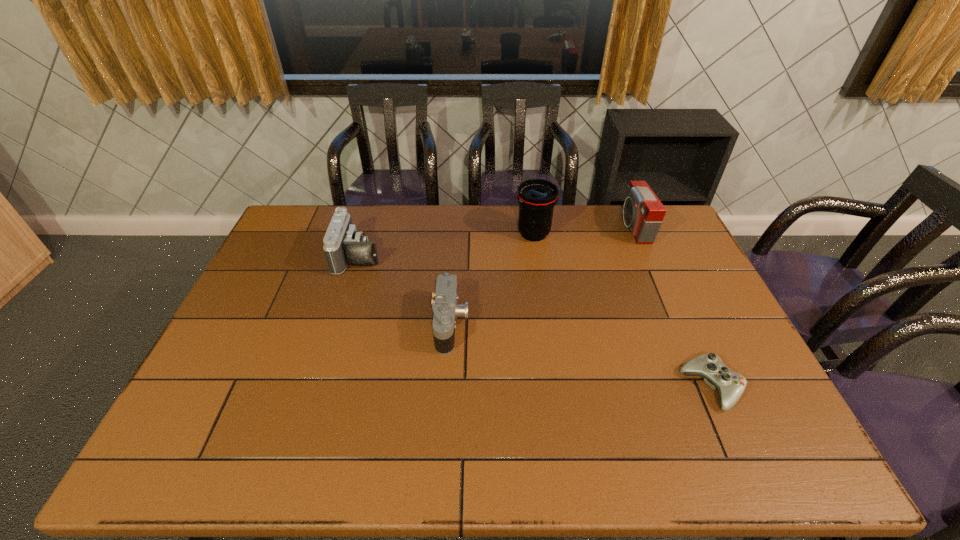
You are a GUI agent. You are given a task and a screenshot of the screen. Output one action in this format:
    pyautogui.click(x=<x>, y=<y>)
    Task: Click on the telephoto lens
    
    Given the screenshot: What is the action you would take?
    pyautogui.click(x=536, y=197)

Find the location of `the tallest object`. the tallest object is located at coordinates (536, 197).

Where is `the rightmost camera`? the rightmost camera is located at coordinates (643, 212).

Find the location of a particular element. the leftmost object is located at coordinates (343, 244).

Where is `the nearest camera`? the nearest camera is located at coordinates (446, 309).

This screenshot has width=960, height=540. I want to click on the shortest camera, so click(446, 309).

The width and height of the screenshot is (960, 540). What are the coordinates of `the shortest object` in the screenshot? It's located at (730, 385).

Locate an element on the screen. The width and height of the screenshot is (960, 540). the nearest object is located at coordinates (730, 385).

Where is `vacant space located on the front of the telephoto lens`? vacant space located on the front of the telephoto lens is located at coordinates (539, 270).

Image resolution: width=960 pixels, height=540 pixels. Identify the location of vacant space located 0.240m on the front-facing side of the rightmost camera. (557, 227).